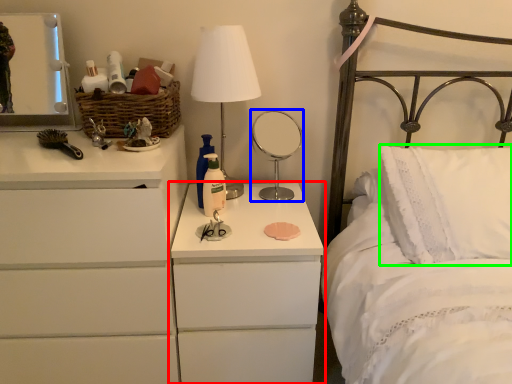
Question: Which object is positioned closest to nightstand (highlighted by a red box)? Select from mirror (highlighted by a blue box) and pillow (highlighted by a green box).

Choices:
 (A) mirror
 (B) pillow

Answer: (B)